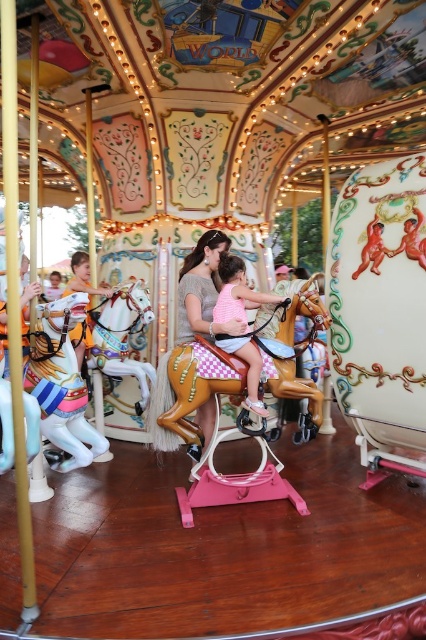
Who is more forward, [199,330] or [227,266]?

Point [199,330] is more forward.

Which is more to the right, matte pink dress at center or pink cotton dress at center?

pink cotton dress at center

Who is more distant from viewer, (181, 326) or (261, 304)?

Positioned behind is point (181, 326).

Where is `matte pink dress at center`? The height and width of the screenshot is (640, 426). matte pink dress at center is located at coordinates (204, 291).

Is painted wood horse at left taller than matte pink dress at center?

Incorrect, painted wood horse at left's height is not larger of matte pink dress at center's.

Is painted wood horse at left above matte pink dress at center?

No, painted wood horse at left is not above matte pink dress at center.

Describe the element at coordinates (63, 387) in the screenshot. I see `painted wood horse at left` at that location.

Locate an element on the screen. The height and width of the screenshot is (640, 426). painted wood horse at left is located at coordinates (63, 387).

Can you confirm if matte pink dress at center is positioned below shiny silver horse at center?

No, matte pink dress at center is not below shiny silver horse at center.

Is point (189, 275) more distant than point (112, 372)?

No, it is in front of (112, 372).

The image size is (426, 640). In order to click on matte pink dress at center in this screenshot , I will do `click(204, 291)`.

Locate an element on the screen. Image resolution: width=426 pixels, height=640 pixels. matte pink dress at center is located at coordinates (204, 291).